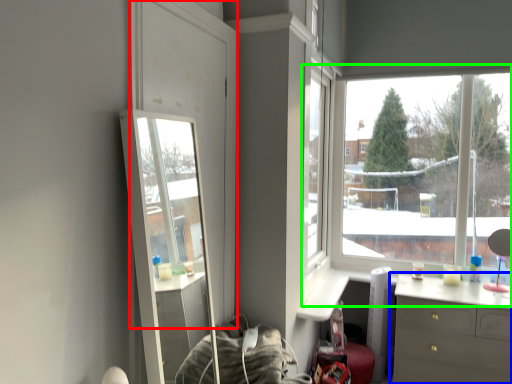
Question: Which is farther away from glass door (highlighted by a red box)? chest of drawers (highlighted by a blue box) or window (highlighted by a green box)?

Choices:
 (A) chest of drawers
 (B) window

Answer: (B)